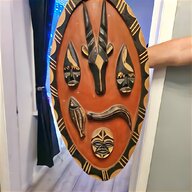
Where is `wall`? This screenshot has height=192, width=192. wall is located at coordinates (174, 158).